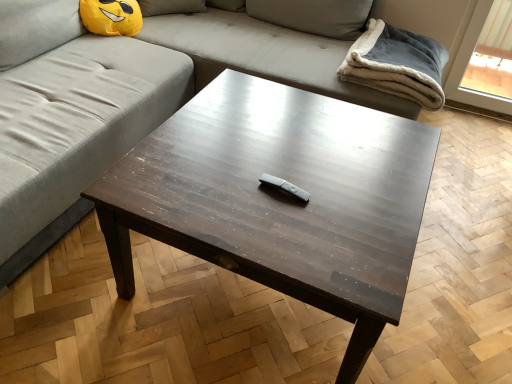
Find the location of a particular element. The width and height of the screenshot is (512, 384). free spot to the left of gray matte wii remote at center is located at coordinates (228, 187).